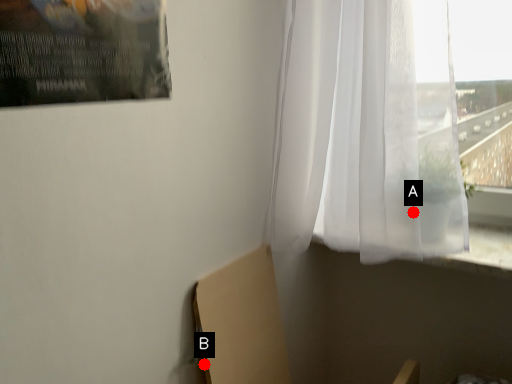
Question: Two points are circled on the image, labeled by A and B beside each circle. Which point is farther from the camera taking this photo?

Choices:
 (A) A is further
 (B) B is further

Answer: (A)